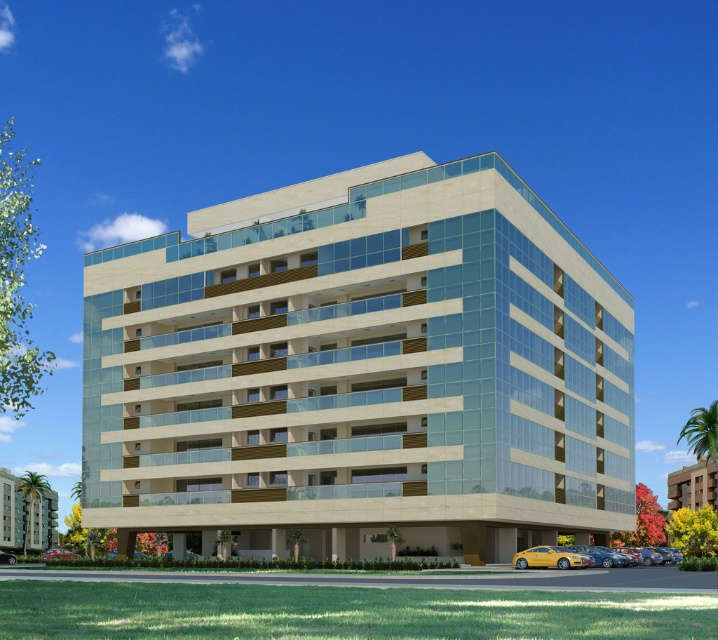
You are standing in front of the beige stone hotel at lower right and want to park your metallic red car at lower left. Which direction should you move the car to align it with the hotel?

The beige stone hotel at lower right is to the right of the metallic red car at lower left. To align the metallic red car at lower left with the hotel, you should move it to the right.

You are standing in front of the beige stone building at center and want to park your yellow matte car at lower right. Is the car currently in a parking spot that is directly in front of the building?

The beige stone building at center is positioned over the yellow matte car at lower right, meaning the car is parked directly in front of the building. Therefore, the car is in a parking spot that is directly in front of the building.

You are a photographer planning to capture the beige stone hotel at lower right and the yellow matte car at lower center in a single shot. Given that the car is closer to you, will the hotel still appear taller in the photograph?

Yes, the beige stone hotel at lower right will still appear taller in the photograph than the yellow matte car at lower center because the hotel is actually taller, even though the car is closer. Perspective does not change the relative sizes in terms of actual height, only their apparent size in the frame.